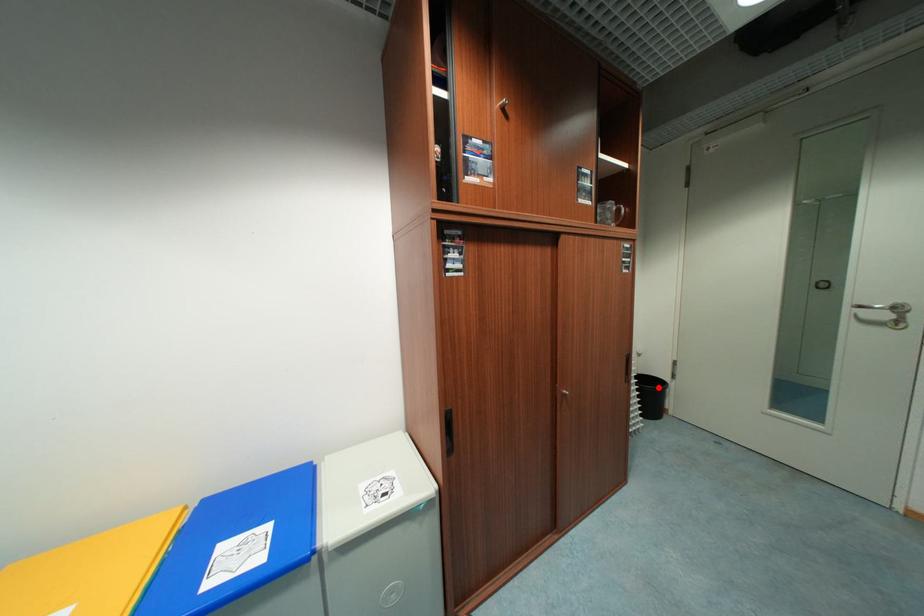
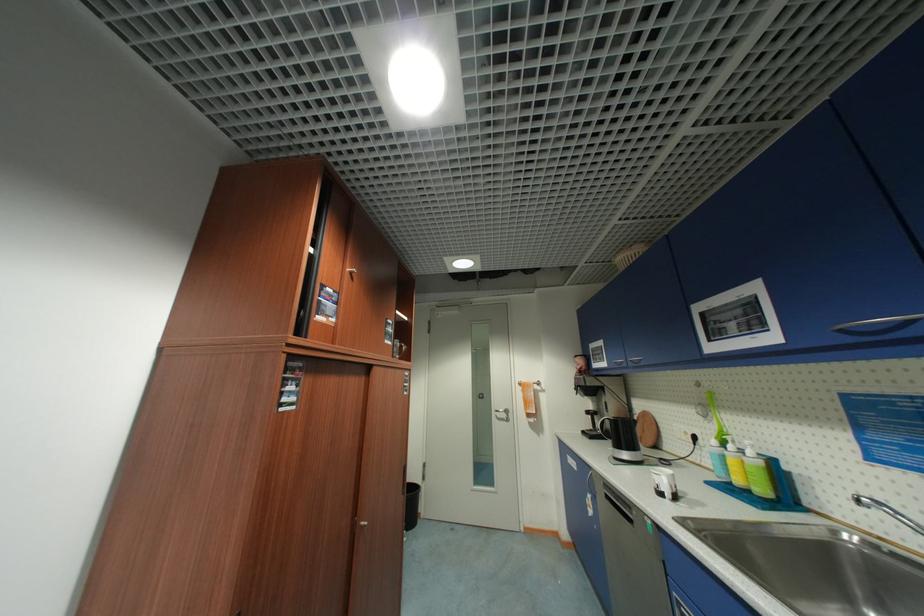
Where in the second image is the point corresponding to the highlighted location from the first image?

(418, 493)